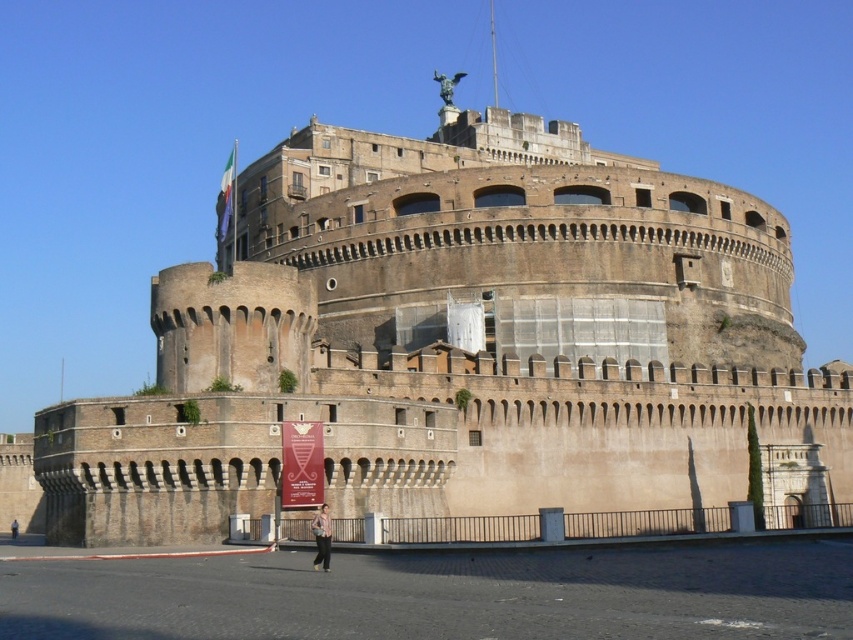
Between point (335, 355) and point (326, 568), which one is positioned in front?

Point (326, 568) is in front.

Describe the element at coordinates (456, 340) in the screenshot. The image size is (853, 640). I see `brown stone castle at center` at that location.

I want to click on brown stone castle at center, so click(x=456, y=340).